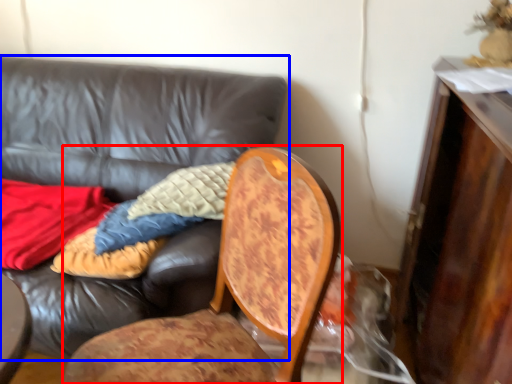
Question: Which point is closer to the camera, chair (highlighted by a red box) or studio couch (highlighted by a blue box)?

Choices:
 (A) chair
 (B) studio couch

Answer: (A)